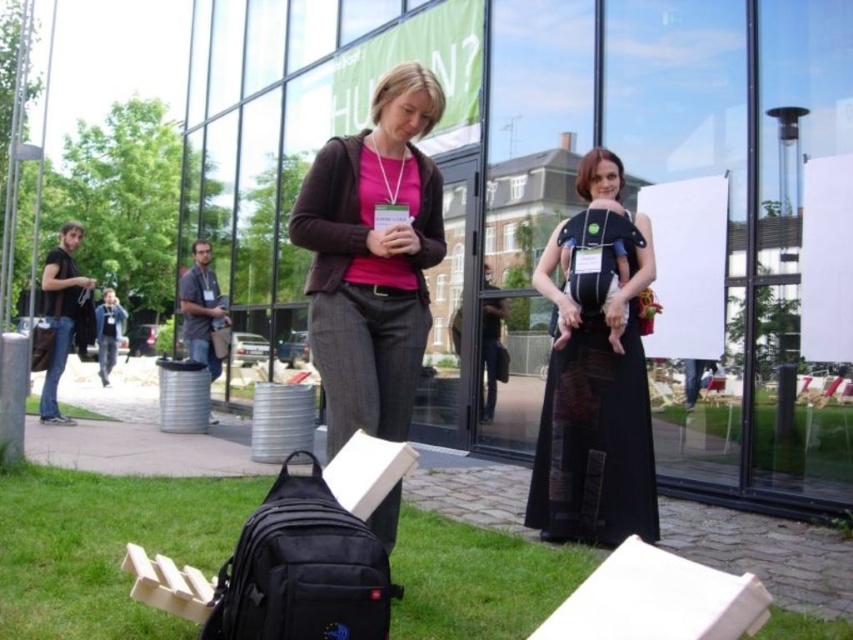
I want to click on matte black jacket at center, so click(372, 259).

Where is `matte black jacket at center`? matte black jacket at center is located at coordinates (372, 259).

Who is higher up, matte black jacket at center or black fabric baby carrier at center?

matte black jacket at center

Is point (418, 250) behind point (601, 314)?

No, (418, 250) is closer to viewer.

Which is in front, point (316, 349) or point (546, 532)?

Point (316, 349) is in front.

You are a GUI agent. You are given a task and a screenshot of the screen. Output one action in this format:
    pyautogui.click(x=<x>, y=<y>)
    Task: Click on the matte black jacket at center
    The image size is (853, 640).
    Given the screenshot: What is the action you would take?
    [x=372, y=259]

Does black fabric baby carrier at center have a greater width compared to black cotton shirt at left?

In fact, black fabric baby carrier at center might be narrower than black cotton shirt at left.

Can you confirm if black fabric baby carrier at center is shorter than black cotton shirt at left?

No.

At what (x,y) coordinates should I click in order to perform the action: click on black fabric baby carrier at center. Please return your answer as a coordinate pair (x, y). Image resolution: width=853 pixels, height=640 pixels. Looking at the image, I should click on (595, 413).